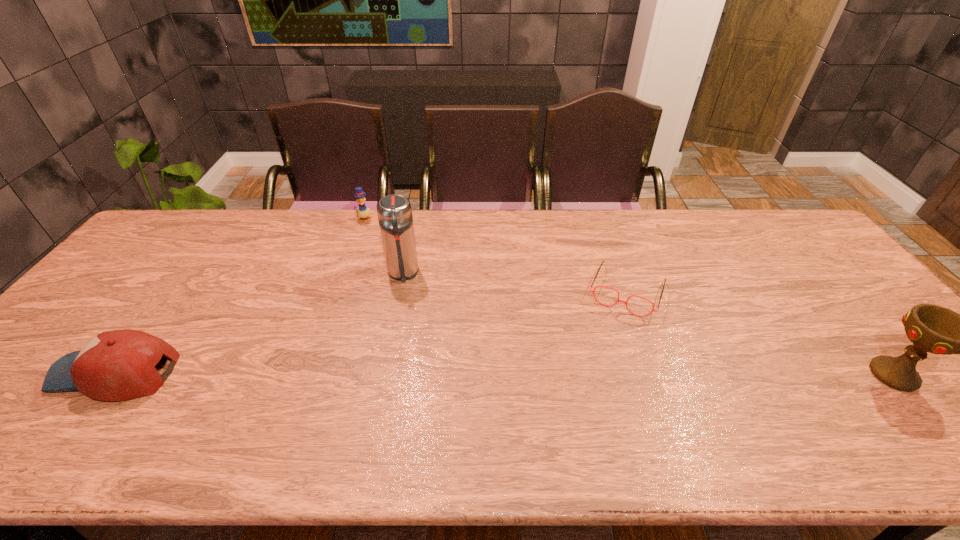
This screenshot has height=540, width=960. I want to click on vacant area that lies between the farthest object and the baseball cap, so click(x=240, y=296).

Locate an element on the screen. empty location between the shortest object and the baseball cap is located at coordinates (371, 332).

Where is `vacant space that is in between the shortest object and the baseball cap`? The image size is (960, 540). vacant space that is in between the shortest object and the baseball cap is located at coordinates (371, 332).

I want to click on blank region between the chalice and the shortest object, so click(x=759, y=333).

Where is `vacant point located between the thermos bottle and the second object from right to left`? Image resolution: width=960 pixels, height=540 pixels. vacant point located between the thermos bottle and the second object from right to left is located at coordinates (515, 282).

I want to click on vacant space in between the fourth shortest object and the shortest object, so click(x=759, y=333).

Image resolution: width=960 pixels, height=540 pixels. I want to click on free spot between the leftmost object and the spectacles, so click(371, 332).

Where is `the third closest object to the second object from left to right`? The width and height of the screenshot is (960, 540). the third closest object to the second object from left to right is located at coordinates (593, 291).

Locate which object ranks second in proximity to the leftmost object. Please provide its 2D coordinates. Your answer should be formatted as a tuple, i.e. [(x, y)], where the tuple contains the x and y coordinates of a point satisfying the conditions above.

[(363, 212)]